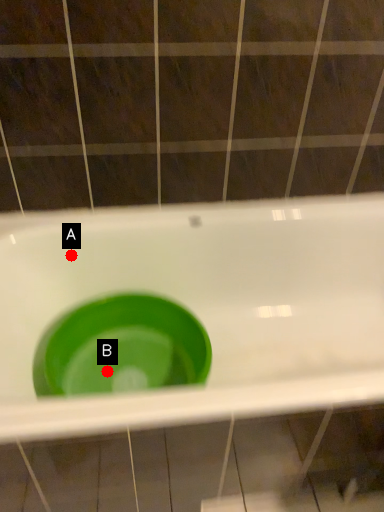
Question: Two points are circled on the image, labeled by A and B beside each circle. Which point is farther to the camera?

Choices:
 (A) A is further
 (B) B is further

Answer: (B)